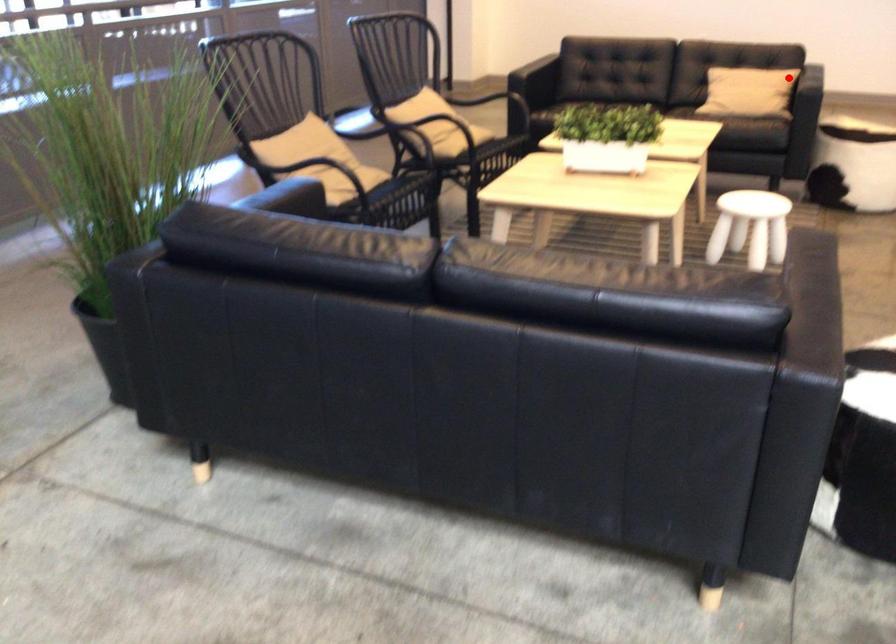
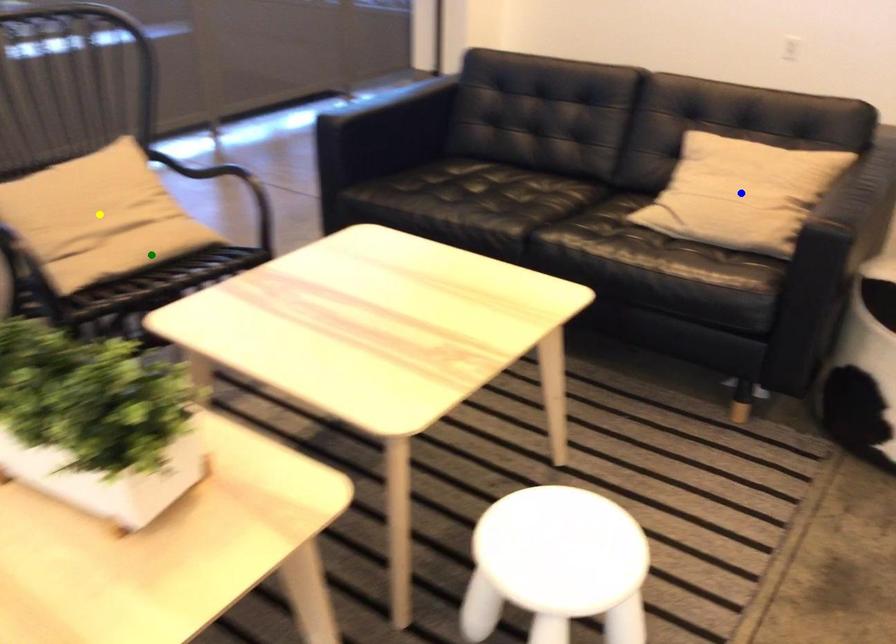
Question: I am providing you with two images of the same scene from different viewpoints. A red point is marked on the first image. You are given multiple points on the second image. Can you choose the point in image 2 that corresponds to the point in image 1?

Choices:
 (A) green point
 (B) yellow point
 (C) blue point

Answer: (C)